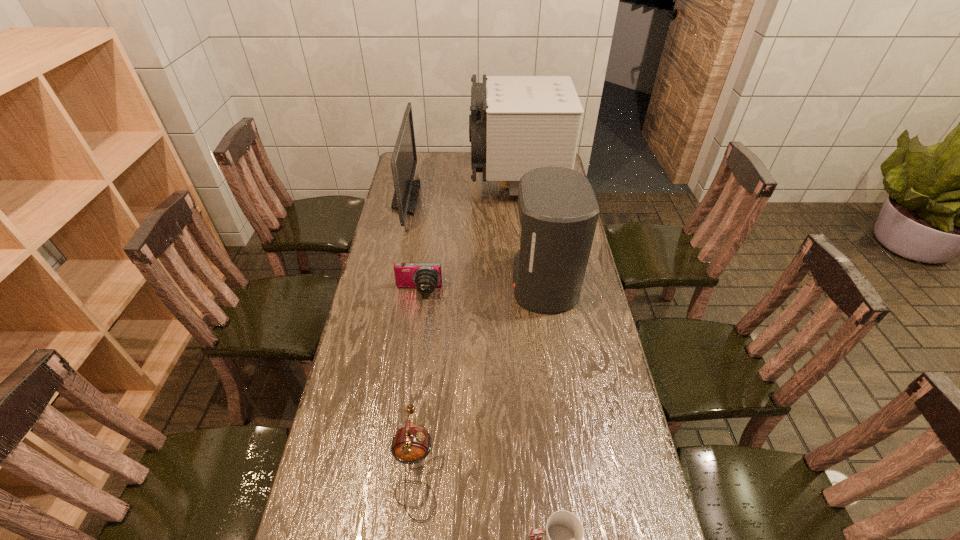
Identify the location of free region at the left edge. (414, 178).

Where is `free space at the right edge of the desktop`? Image resolution: width=960 pixels, height=540 pixels. free space at the right edge of the desktop is located at coordinates (625, 405).

Where is `vacant space at the far left corner of the desktop`? Image resolution: width=960 pixels, height=540 pixels. vacant space at the far left corner of the desktop is located at coordinates (415, 177).

At what (x,y) coordinates should I click in order to perform the action: click on unoccupied position between the fourth shortest object and the fan. Please return your answer as a coordinate pair (x, y). Image resolution: width=960 pixels, height=540 pixels. Looking at the image, I should click on (461, 192).

Find the location of a particular element. This screenshot has width=960, height=540. unoccupied position between the camera and the third tallest object is located at coordinates (412, 245).

This screenshot has width=960, height=540. I want to click on vacant area that lies between the telephone and the camera, so click(x=418, y=380).

In order to click on free point between the camera and the third tallest object in this screenshot , I will do `click(412, 245)`.

Where is `empty space between the telephone and the fan`? The image size is (960, 540). empty space between the telephone and the fan is located at coordinates (467, 327).

The width and height of the screenshot is (960, 540). In order to click on vacant area that lies between the fan and the telephone in this screenshot , I will do `click(467, 327)`.

You are a GUI agent. You are given a task and a screenshot of the screen. Output one action in this format:
    pyautogui.click(x=<x>, y=<y>)
    Task: Click on the blank region between the monitor and the second nearest object
    This screenshot has height=540, width=960.
    Given the screenshot: What is the action you would take?
    pyautogui.click(x=411, y=333)